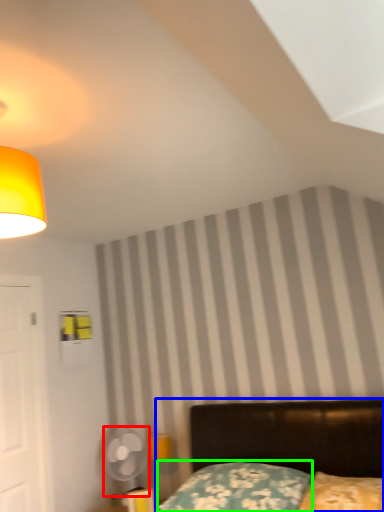
Question: Based on their relative distances, which object is nearer to mechanical fan (highlighted by a red box)? Choose from bed (highlighted by a blue box) and pillow (highlighted by a green box).

Choices:
 (A) bed
 (B) pillow

Answer: (B)